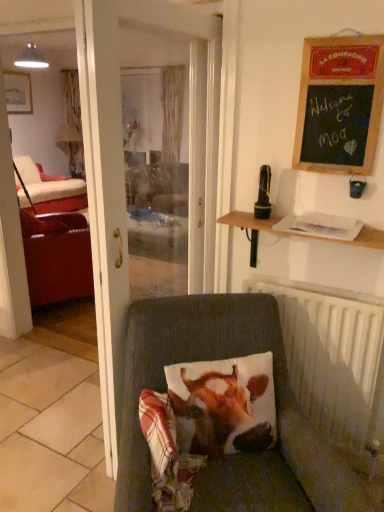
Question: Is black chalkboard at upper right positioned before white metallic radiator at lower right?

Choices:
 (A) no
 (B) yes

Answer: (B)

Question: From the image's perspective, is black chalkboard at upper right above white metallic radiator at lower right?

Choices:
 (A) yes
 (B) no

Answer: (A)

Question: From a real-world perspective, is black chalkboard at upper right located beneath white metallic radiator at lower right?

Choices:
 (A) no
 (B) yes

Answer: (A)

Question: Can you confirm if black chalkboard at upper right is taller than white metallic radiator at lower right?

Choices:
 (A) yes
 (B) no

Answer: (B)

Question: Can you confirm if black chalkboard at upper right is bigger than white metallic radiator at lower right?

Choices:
 (A) yes
 (B) no

Answer: (B)

Question: From the image's perspective, is white metallic radiator at lower right above or below black chalkboard at upper right?

Choices:
 (A) below
 (B) above

Answer: (A)

Question: Considering the relative positions of white metallic radiator at lower right and black chalkboard at upper right in the image provided, is white metallic radiator at lower right to the left or to the right of black chalkboard at upper right?

Choices:
 (A) right
 (B) left

Answer: (B)

Question: In terms of width, does white metallic radiator at lower right look wider or thinner when compared to black chalkboard at upper right?

Choices:
 (A) wide
 (B) thin

Answer: (A)

Question: From a real-world perspective, is white metallic radiator at lower right positioned above or below black chalkboard at upper right?

Choices:
 (A) below
 (B) above

Answer: (A)

Question: Is black chalkboard at upper right taller or shorter than printed fabric cow at center?

Choices:
 (A) tall
 (B) short

Answer: (A)

Question: From the image's perspective, is black chalkboard at upper right above or below printed fabric cow at center?

Choices:
 (A) below
 (B) above

Answer: (B)

Question: Is point pos(314,47) closer or farther from the camera than point pos(246,406)?

Choices:
 (A) closer
 (B) farther

Answer: (B)

Question: Based on their sizes in the image, would you say black chalkboard at upper right is bigger or smaller than printed fabric cow at center?

Choices:
 (A) big
 (B) small

Answer: (B)

Question: Is printed fabric cow at center wider or thinner than velvet cushion at lower center?

Choices:
 (A) thin
 (B) wide

Answer: (A)

Question: From a real-world perspective, relative to velvet cushion at lower center, is printed fabric cow at center vertically above or below?

Choices:
 (A) above
 (B) below

Answer: (A)